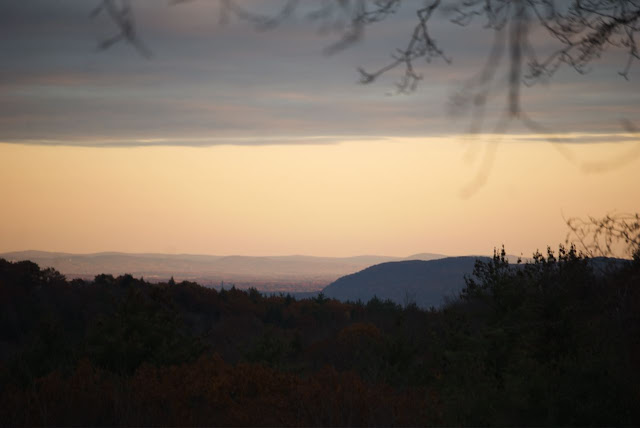
Where is `cloud shelf`? cloud shelf is located at coordinates (243, 107).